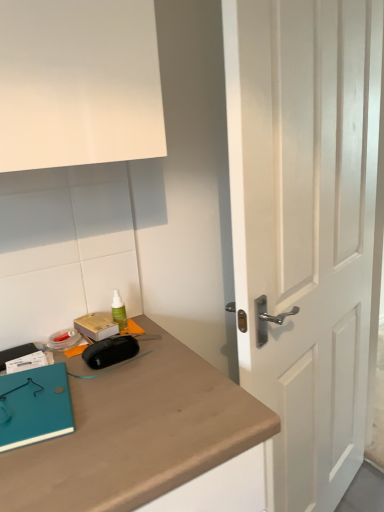
Question: Based on their sizes in the image, would you say teal matte notebook at lower left is bigger or smaller than white wooden door at center?

Choices:
 (A) small
 (B) big

Answer: (A)

Question: Looking at their shapes, would you say teal matte notebook at lower left is wider or thinner than white wooden door at center?

Choices:
 (A) thin
 (B) wide

Answer: (B)

Question: Which is nearer to the teal matte notebook at lower left?

Choices:
 (A) white wooden door at center
 (B) green plastic spray bottle at upper center

Answer: (B)

Question: Based on their relative distances, which object is nearer to the teal matte notebook at lower left?

Choices:
 (A) green plastic spray bottle at upper center
 (B) white wooden door at center

Answer: (A)